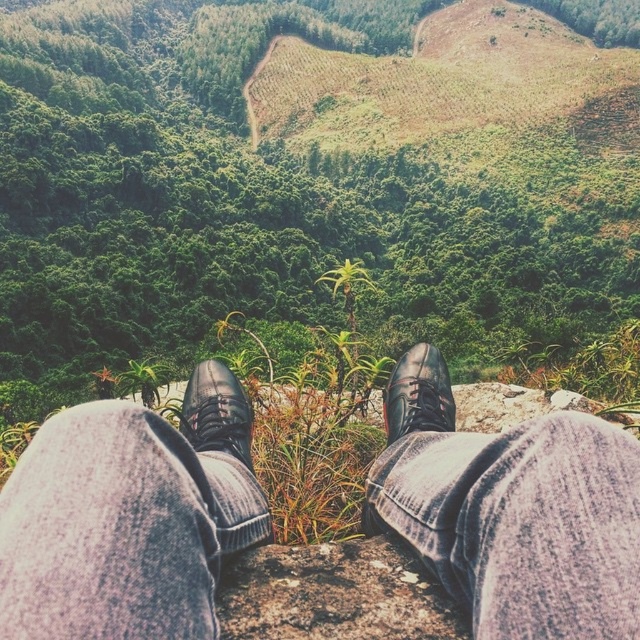
You are a photographer trying to capture a closeup of the shiny black shoe at center while also including the green leafy vegetation at center in the background. Based on their positions, will the vegetation be in focus if you focus on the shoe?

The green leafy vegetation at center is further to the viewer than shiny black shoe at center. If you focus on the shiny black shoe at center, the vegetation will be out of focus because it is closer to the camera, creating a shallow depth of field where only the shoe is in focus.

You are a hiker who wants to take a photo of the shiny black shoe at center from above. Can you see the green leafy vegetation at center in the background of the photo?

The green leafy vegetation at center is much taller than the shiny black shoe at center, so when taking a photo from above, the vegetation will likely block the view of the shoe or appear in front of it, making it hard to capture the shoe clearly in the foreground with the vegetation in the background.

You are a photographer taking a picture of the landscape. You notice two shoes at the center of your frame. Which one is shorter between the black leather shoe at center and the shiny black shoe at center?

The black leather shoe at center is shorter than the shiny black shoe at center.